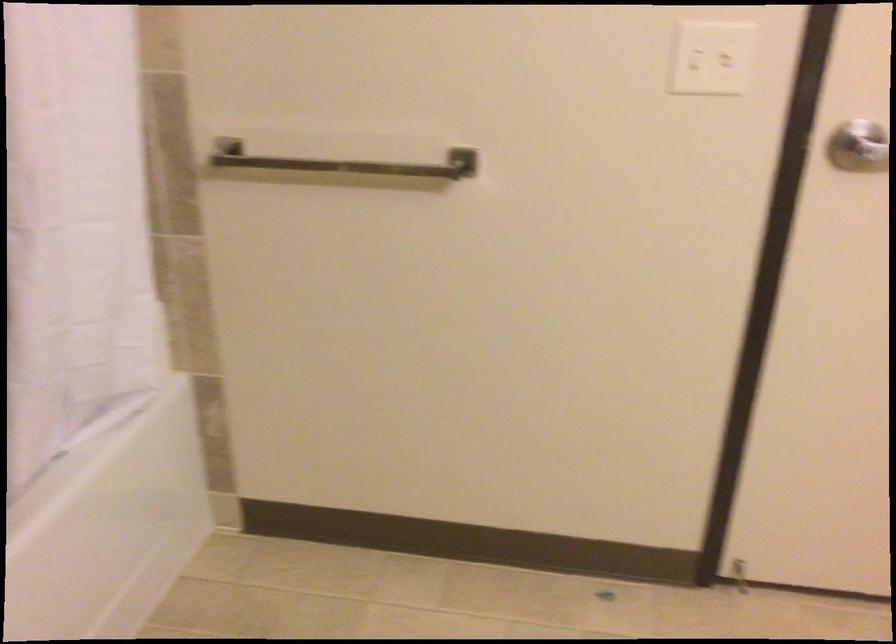
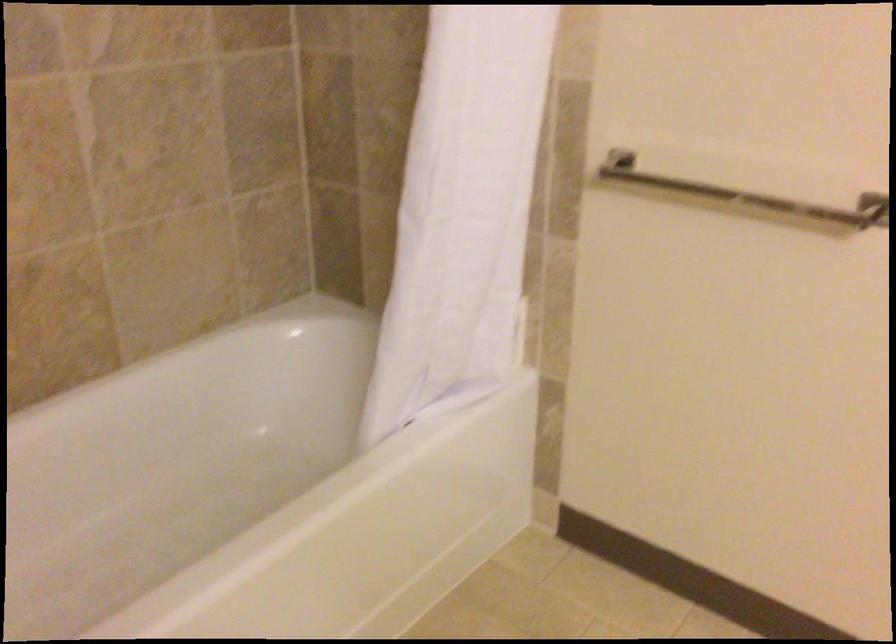
The point at (349, 162) is marked in the first image. Where is the corresponding point in the second image?

(745, 194)